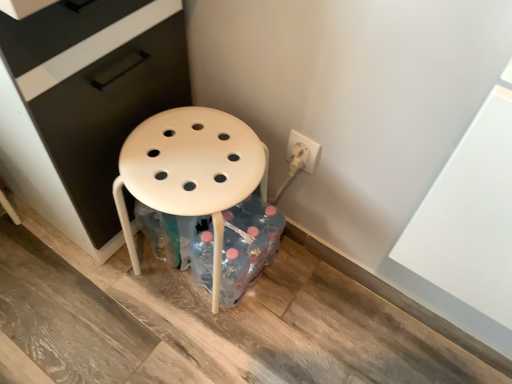
Question: Considering the relative positions of translucent plastic bottles at lower center and white plastic stool at center in the image provided, is translucent plastic bottles at lower center to the left of white plastic stool at center from the viewer's perspective?

Choices:
 (A) no
 (B) yes

Answer: (A)

Question: Is translucent plastic bottles at lower center outside of white plastic stool at center?

Choices:
 (A) no
 (B) yes

Answer: (A)

Question: From the image's perspective, is translucent plastic bottles at lower center above white plastic stool at center?

Choices:
 (A) yes
 (B) no

Answer: (B)

Question: Does translucent plastic bottles at lower center come behind white plastic stool at center?

Choices:
 (A) yes
 (B) no

Answer: (A)

Question: Is white plastic stool at center at the back of translucent plastic bottles at lower center?

Choices:
 (A) yes
 (B) no

Answer: (A)

Question: Is translucent plastic bottles at lower center thinner than white plastic stool at center?

Choices:
 (A) no
 (B) yes

Answer: (B)

Question: Can you confirm if white plastic stool at center is positioned to the left of white plastic outlet at right?

Choices:
 (A) yes
 (B) no

Answer: (A)

Question: Is white plastic outlet at right located within white plastic stool at center?

Choices:
 (A) no
 (B) yes

Answer: (A)

Question: Is white plastic stool at center bigger than white plastic outlet at right?

Choices:
 (A) no
 (B) yes

Answer: (B)

Question: From a real-world perspective, is white plastic stool at center positioned over white plastic outlet at right based on gravity?

Choices:
 (A) no
 (B) yes

Answer: (A)

Question: From the image's perspective, does white plastic stool at center appear higher than white plastic outlet at right?

Choices:
 (A) yes
 (B) no

Answer: (B)

Question: Does white plastic stool at center have a lesser width compared to white plastic outlet at right?

Choices:
 (A) no
 (B) yes

Answer: (A)

Question: Can you confirm if white plastic outlet at right is thinner than white plastic stool at center?

Choices:
 (A) no
 (B) yes

Answer: (B)